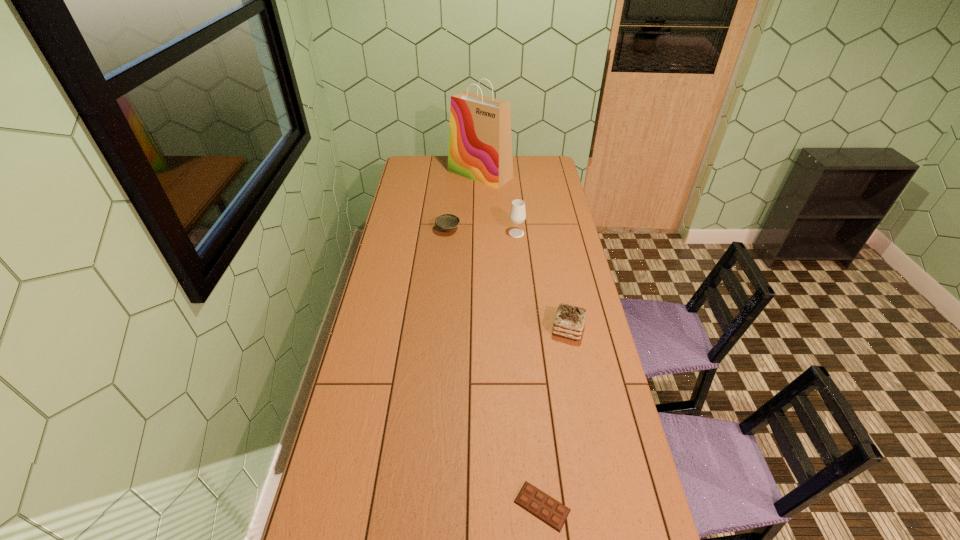
Identify the location of the tallest object. Image resolution: width=960 pixels, height=540 pixels. (480, 144).

This screenshot has height=540, width=960. Find the location of `the farthest object`. the farthest object is located at coordinates (480, 144).

Image resolution: width=960 pixels, height=540 pixels. Identify the location of glass. (517, 215).

In order to click on chocolate cake in this screenshot , I will do tap(569, 321).

Where is `the third tallest object`? the third tallest object is located at coordinates (569, 321).

At what (x,y) coordinates should I click in order to perform the action: click on the fourth tallest object. Please return your answer as a coordinate pair (x, y). The image size is (960, 540). Looking at the image, I should click on (447, 222).

Where is `the nearest object`? the nearest object is located at coordinates (530, 498).

Where is `chocolate bar`? This screenshot has height=540, width=960. chocolate bar is located at coordinates (530, 498).

The width and height of the screenshot is (960, 540). Find the location of `free spot located 0.110m on the front of the shopping bag`. free spot located 0.110m on the front of the shopping bag is located at coordinates (480, 200).

Find the location of a particular element. free region located 0.210m on the back of the glass is located at coordinates 514,205.